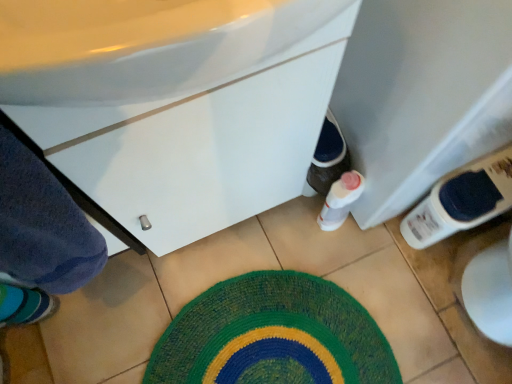
Question: From the image's perspective, is knitted green bath mat at center positioned above or below white plastic bottle at lower right?

Choices:
 (A) below
 (B) above

Answer: (A)

Question: From a real-world perspective, is knitted green bath mat at center positioned above or below white plastic bottle at lower right?

Choices:
 (A) below
 (B) above

Answer: (A)

Question: Which object is positioned farthest from the knitted green bath mat at center?

Choices:
 (A) white plastic bottle at lower right
 (B) white glossy cabinet at center

Answer: (B)

Question: Considering the real-world distances, which object is farthest from the white glossy cabinet at center?

Choices:
 (A) knitted green bath mat at center
 (B) white plastic bottle at lower right

Answer: (B)